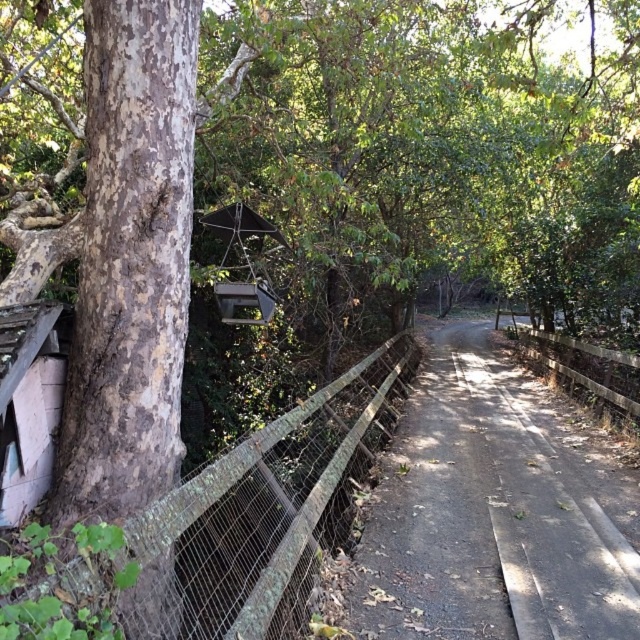
Question: Which point is farther to the camera?

Choices:
 (A) (563, 385)
 (B) (545, 632)

Answer: (A)

Question: Based on their relative distances, which object is nearer to the dirt road at center?

Choices:
 (A) green mossy wire mesh at left
 (B) wooden at right

Answer: (B)

Question: Which object appears closest to the camera in this image?

Choices:
 (A) green mossy wire mesh at left
 (B) rustic wooden hut at lower left
 (C) wooden at right

Answer: (B)

Question: Where is green mossy wire mesh at left located in relation to wooden at right in the image?

Choices:
 (A) above
 (B) below

Answer: (B)

Question: Considering the relative positions of rustic wooden hut at lower left and wooden at right in the image provided, where is rustic wooden hut at lower left located with respect to wooden at right?

Choices:
 (A) below
 (B) above

Answer: (B)

Question: Is dirt road at center thinner than green mossy wire mesh at left?

Choices:
 (A) no
 (B) yes

Answer: (A)